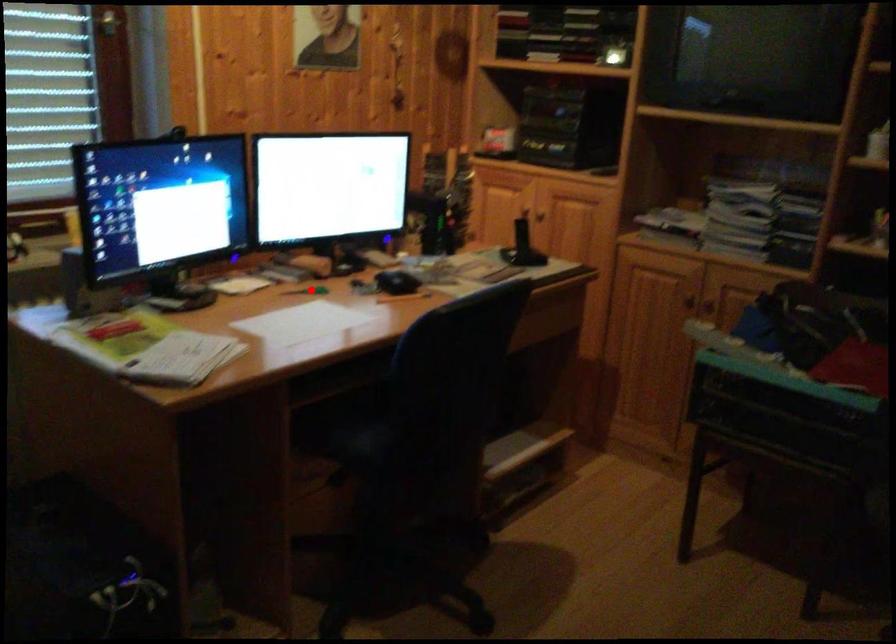
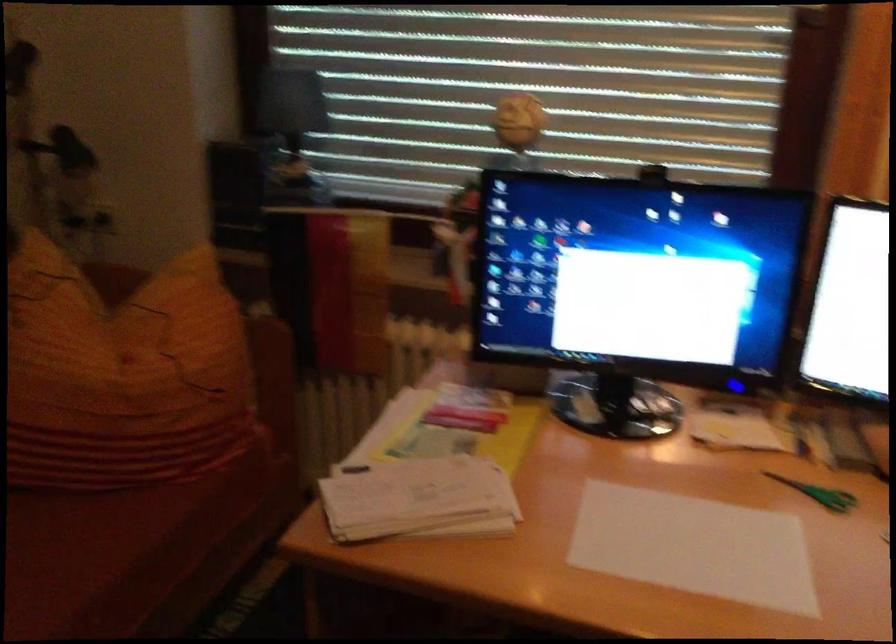
Question: I am providing you with two images of the same scene from different viewpoints. A red point is marked on the first image. At the location where the point appears in image 1, is it still visible in image 2?

Choices:
 (A) Yes
 (B) No

Answer: (A)